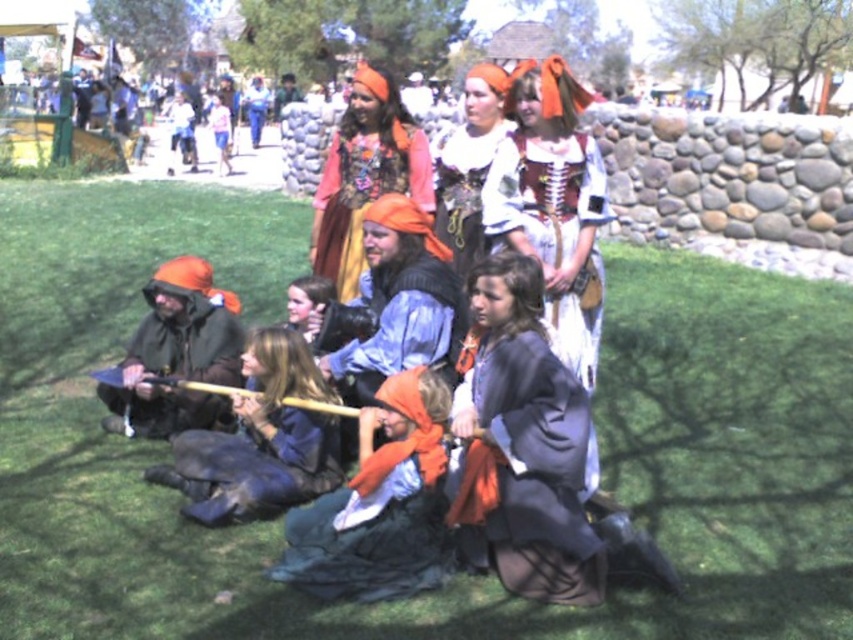
Question: Is white lace dress at center wider than orange fabric hood at center?

Choices:
 (A) yes
 (B) no

Answer: (B)

Question: In this image, where is green grass at center located relative to brown leather jacket at lower left?

Choices:
 (A) left
 (B) right

Answer: (B)

Question: Which object appears closest to the camera in this image?

Choices:
 (A) orange fabric hood at center
 (B) white lace dress at center
 (C) dark gray fabric cape at lower center
 (D) floral fabric dress at center

Answer: (C)

Question: From the image, what is the correct spatial relationship of dark gray fabric cape at lower center in relation to white lace dress at center?

Choices:
 (A) above
 (B) below

Answer: (B)

Question: Among these points, which one is nearest to the camera?

Choices:
 (A) pyautogui.click(x=456, y=218)
 (B) pyautogui.click(x=434, y=449)
 (C) pyautogui.click(x=492, y=589)
 (D) pyautogui.click(x=505, y=518)

Answer: (D)

Question: Among these objects, which one is farthest from the camera?

Choices:
 (A) matte orange headscarf at center
 (B) brown leather jacket at lower left
 (C) orange fabric hood at center

Answer: (A)